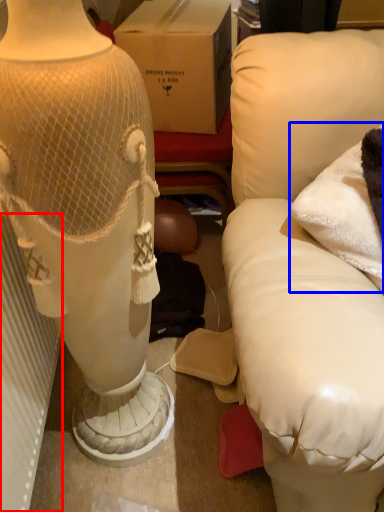
Question: Which of the following is the farthest to the observer, radiator (highlighted by a red box) or pillow (highlighted by a blue box)?

Choices:
 (A) radiator
 (B) pillow

Answer: (B)